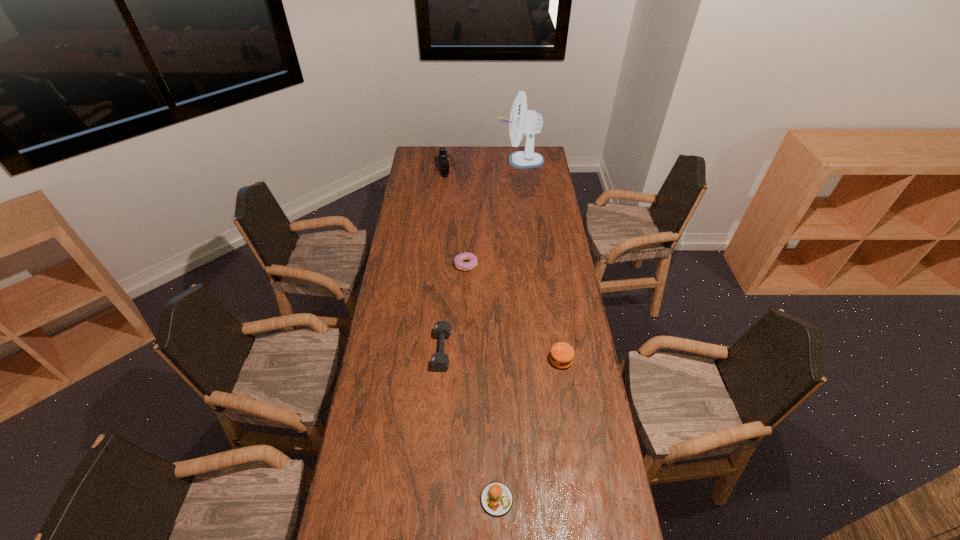
Image resolution: width=960 pixels, height=540 pixels. What are the coordinates of `patty positioned at the right edge` in the screenshot? It's located at (562, 354).

Identify the location of object situated at the far left corner. The height and width of the screenshot is (540, 960). (444, 162).

At what (x,y) coordinates should I click in order to perform the action: click on object present at the far right corner. Please return your answer as a coordinate pair (x, y). The image size is (960, 540). Looking at the image, I should click on (522, 121).

In the image, there is a desktop. Identify the location of blank space at the far edge. The image size is (960, 540). (515, 167).

I want to click on free space at the left edge, so click(x=382, y=534).

Find the location of a particular element. Image resolution: width=960 pixels, height=540 pixels. vacant position at the right edge of the desktop is located at coordinates (571, 369).

In the image, there is a desktop. Find the location of `free space at the far left corner`. free space at the far left corner is located at coordinates (437, 146).

The image size is (960, 540). I want to click on vacant area that lies between the nearer patty and the dumbbell, so click(x=469, y=425).

The width and height of the screenshot is (960, 540). Identify the location of free space between the dumbbell and the nearer patty. (469, 425).

You are a GUI agent. You are given a task and a screenshot of the screen. Output one action in this format:
    pyautogui.click(x=<x>, y=<y>)
    Task: Click on the free space between the dumbbell and the third farthest object
    
    Given the screenshot: What is the action you would take?
    pyautogui.click(x=454, y=307)